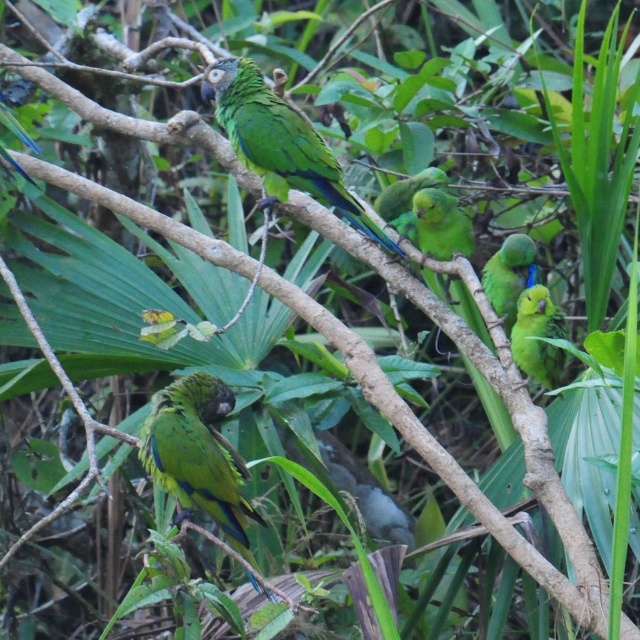
Question: Does green matte parrot at right appear on the right side of green matte parrot at center?

Choices:
 (A) yes
 (B) no

Answer: (A)

Question: Can you confirm if green matte parrot at upper right is bigger than green glossy parrot at center?

Choices:
 (A) yes
 (B) no

Answer: (A)

Question: Which point appears closest to the camera in this image?

Choices:
 (A) (420, 179)
 (B) (264, 100)
 (C) (512, 344)

Answer: (C)

Question: Which point is closer to the camera?

Choices:
 (A) (387, 195)
 (B) (512, 314)
 (C) (541, 358)

Answer: (C)

Question: Which of the following is the closest to the observer?

Choices:
 (A) green glossy parrot at center
 (B) green matte parrot at upper right
 (C) green matte parrot at upper center
 (D) green matte parrot at right

Answer: (D)

Question: From the image, what is the correct spatial relationship of green matte parrot at center in relation to green glossy parrot at center?

Choices:
 (A) left
 (B) right

Answer: (B)